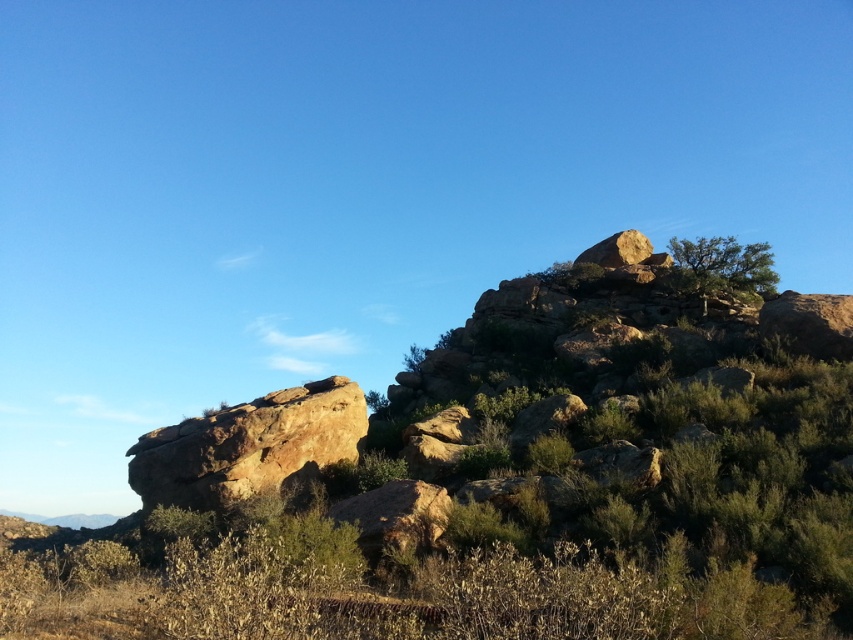
You are standing at the edge of a desert landscape and see the brown rough rock at center. If you want to place a 30 meter long tent in front of it, will the tent fit between you and the rock?

The brown rough rock at center is 26.50 meters away from you. Since the tent is 30 meters long, it would extend beyond the rock, so it won not fit between you and the rock.

You are a geologist examining the landscape. You see the brown rough rock at center and the rustic brown rock at upper right. Which rock is positioned to the left when viewed from your perspective?

The brown rough rock at center is positioned to the left of the rustic brown rock at upper right.